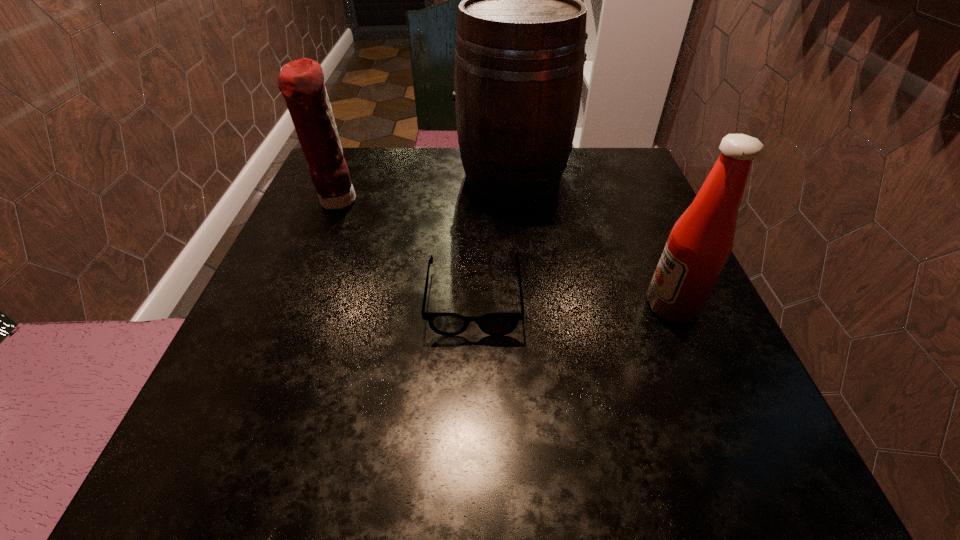
What are the coordinates of `vacant region located 0.130m on the front-facing side of the rightmost object` in the screenshot? It's located at [568, 306].

This screenshot has width=960, height=540. In order to click on free region located on the front-facing side of the rightmost object in this screenshot , I will do `click(448, 306)`.

This screenshot has height=540, width=960. What are the coordinates of `vacant region located on the back of the leftmost object` in the screenshot? It's located at (349, 170).

Find the location of a particular element. The height and width of the screenshot is (540, 960). free region located 0.090m on the arms of the shortest object is located at coordinates (472, 386).

Identify the location of cider present at the far edge. (521, 28).

You are a GUI agent. You are given a task and a screenshot of the screen. Output one action in this format:
    pyautogui.click(x=<x>, y=<y>)
    Task: Click on the condiment at the far edge
    
    Given the screenshot: What is the action you would take?
    pyautogui.click(x=301, y=82)

At what (x,y) coordinates should I click in order to perform the action: click on object that is positioned at the left edge. Please return your answer as a coordinate pair (x, y). Looking at the image, I should click on (301, 82).

At what (x,y) coordinates should I click in order to perform the action: click on object that is at the right edge. Please return your answer as a coordinate pair (x, y). The width and height of the screenshot is (960, 540). Looking at the image, I should click on (698, 246).

The height and width of the screenshot is (540, 960). I want to click on object that is at the far left corner, so click(301, 82).

Find the location of `vacant space at the near edge`. vacant space at the near edge is located at coordinates (496, 449).